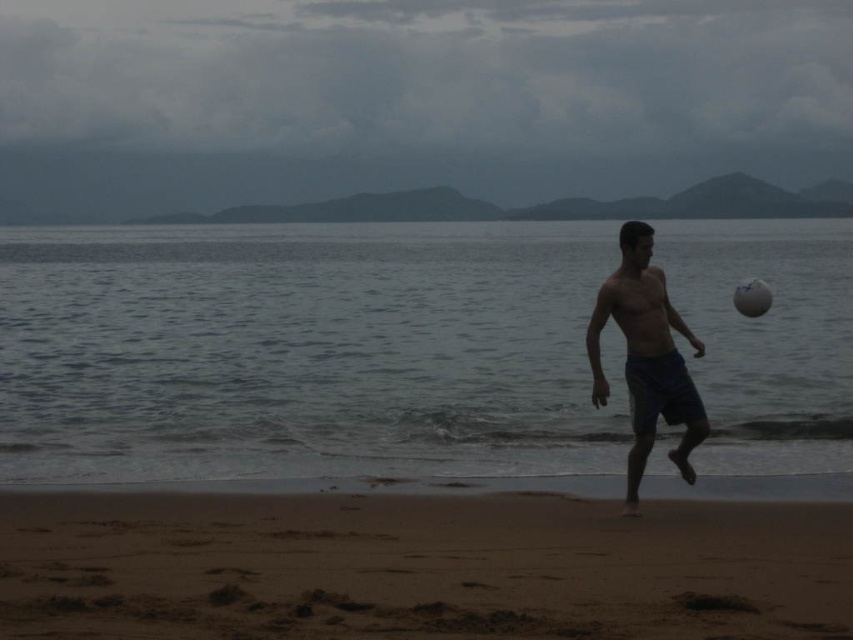
Question: Which point is farther to the camera?

Choices:
 (A) (180, 352)
 (B) (640, 401)
 (C) (16, 628)
 (D) (752, 282)

Answer: (A)

Question: Does brown sandy beach at lower center appear on the left side of blue denim shorts at center?

Choices:
 (A) no
 (B) yes

Answer: (B)

Question: Which point is closer to the camera?

Choices:
 (A) (328, 506)
 (B) (770, 292)
 (C) (138, 452)

Answer: (A)

Question: Which of these objects is positioned closest to the brown sandy beach at lower center?

Choices:
 (A) white matte volleyball at center
 (B) clear water at lower center
 (C) blue denim shorts at center

Answer: (C)

Question: Does brown sandy beach at lower center have a smaller size compared to blue denim shorts at center?

Choices:
 (A) yes
 (B) no

Answer: (A)

Question: Is clear water at lower center bigger than brown sandy beach at lower center?

Choices:
 (A) yes
 (B) no

Answer: (A)